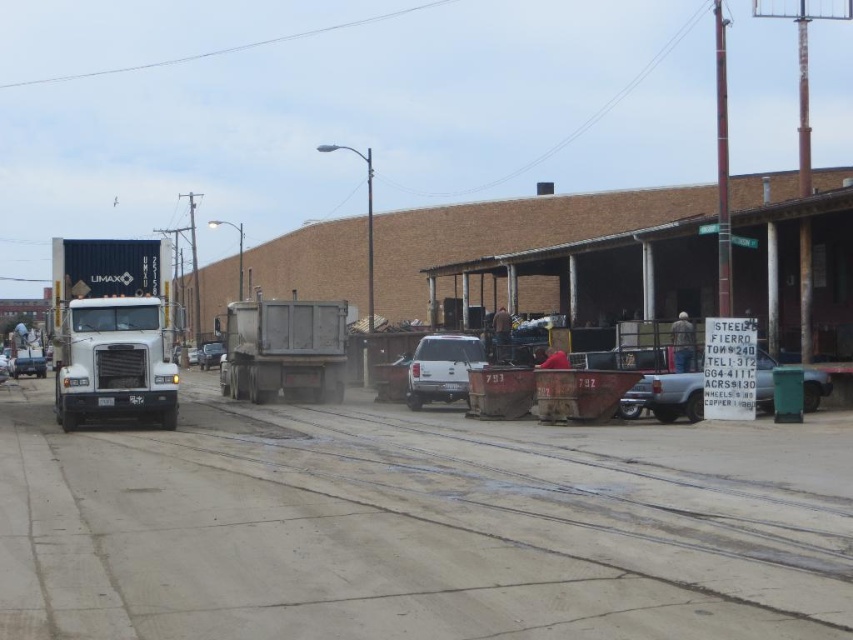
What are the coordinates of the dirt track at center?

The dirt track at center is located at coordinates point (418, 525).

You are a delivery driver who needs to exit the site quickly. You see the matte gray truck at center and the metallic silver sedan at center blocking your path. Which vehicle should you move first to clear the path?

The matte gray truck at center is in front of the metallic silver sedan at center, so you should move the matte gray truck at center first to clear the path.